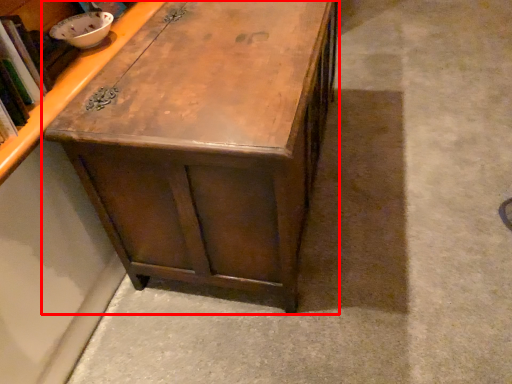
Question: From the image, what is the correct spatial relationship of table (annotated by the red box) in relation to cabinetry?

Choices:
 (A) right
 (B) left

Answer: (A)